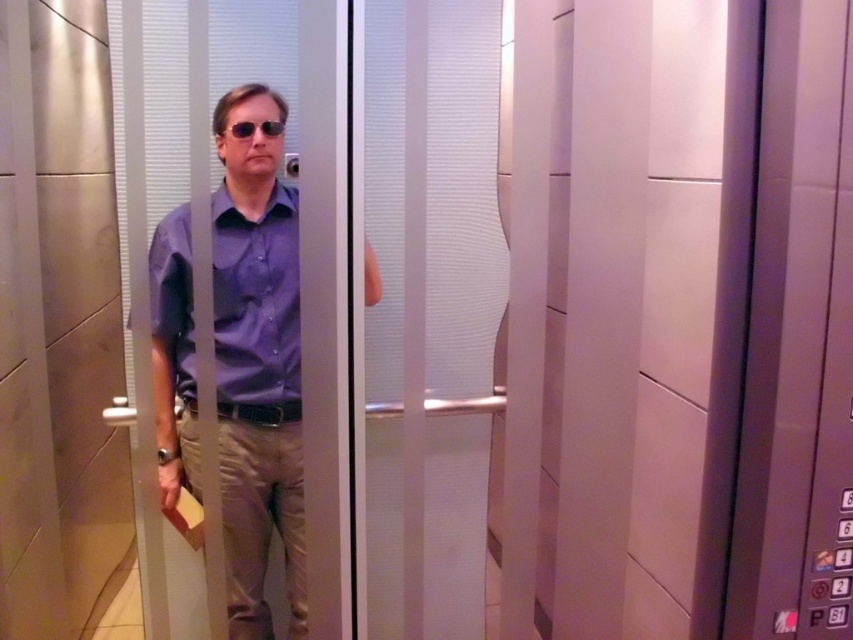
Between purple smooth shirt at center and matte black sunglasses at center, which one has less height?

matte black sunglasses at center is shorter.

Which is behind, point (183, 220) or point (254, 124)?

The point (183, 220) is behind.

Measure the distance between point (x=234, y=234) and camera.

They are 1.62 meters apart.

This screenshot has width=853, height=640. Find the location of `purple smooth shirt at center`. purple smooth shirt at center is located at coordinates (256, 300).

Does purple shirt at center have a larger size compared to purple smooth shirt at center?

Indeed, purple shirt at center has a larger size compared to purple smooth shirt at center.

Can you confirm if purple shirt at center is positioned below purple smooth shirt at center?

Correct, purple shirt at center is located below purple smooth shirt at center.

Find the location of a particular element. The width and height of the screenshot is (853, 640). purple shirt at center is located at coordinates (257, 364).

Locate an element on the screen. purple shirt at center is located at coordinates (257, 364).

Looking at this image, does purple shirt at center have a greater width compared to matte black sunglasses at center?

Correct, the width of purple shirt at center exceeds that of matte black sunglasses at center.

Can you confirm if purple shirt at center is positioned to the left of matte black sunglasses at center?

No, purple shirt at center is not to the left of matte black sunglasses at center.

Locate an element on the screen. purple shirt at center is located at coordinates (257, 364).